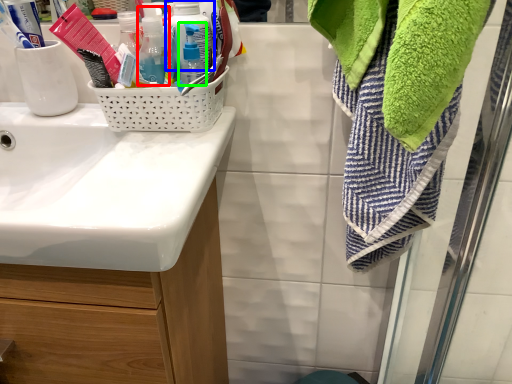
Question: Estimate the real-world distances between objects in this image. Which object is farther from bottle (highlighted by a red box), bottle (highlighted by a blue box) or bottle (highlighted by a green box)?

Choices:
 (A) bottle
 (B) bottle

Answer: (B)